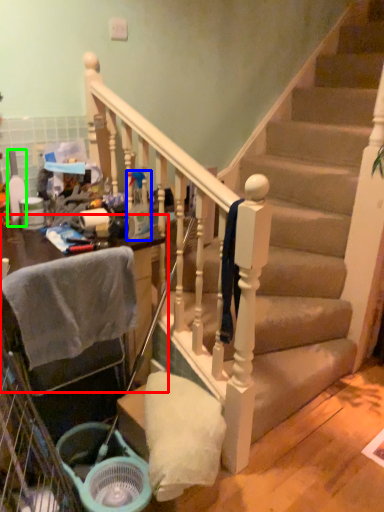
Question: Which object is the farthest from furniture (highlighted by a red box)? Choose among these: bottle (highlighted by a blue box) or bottle (highlighted by a green box).

Choices:
 (A) bottle
 (B) bottle

Answer: (B)